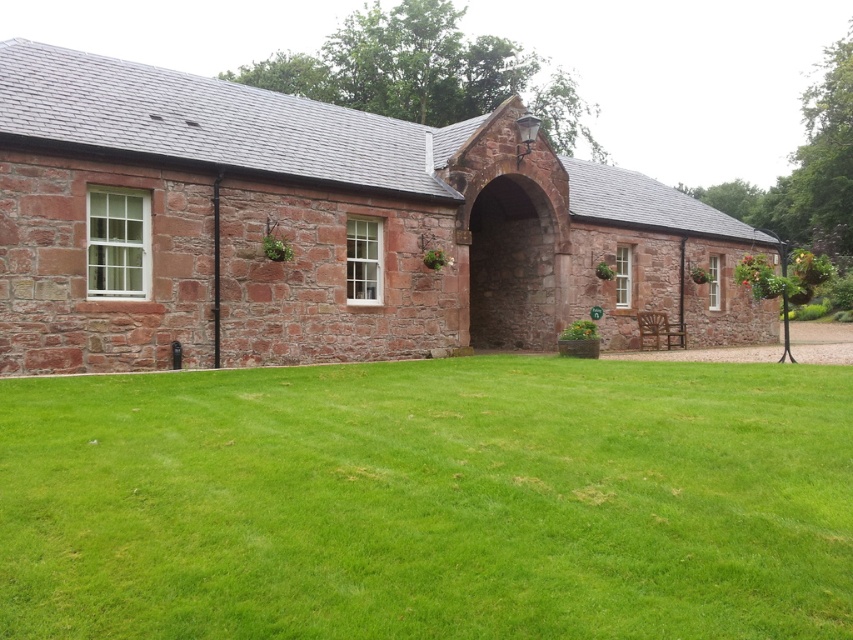
You are standing in front of the stone building and notice two points marked on its facade. The first point is at coordinate point(492, 536) and the second is at point(540, 276). From your vantage point, which point appears closer to you?

Point(492, 536) is in front of point(540, 276), so it appears closer to you.

You are standing in a field and see the green grass at center and the rustic stone chapel at center. Which object is closer to you?

The green grass at center is closer to you because it is in front of the rustic stone chapel at center.

You are an architect planning to install a decorative banner between the rustic stone chapel at center and the rustic stone archway at center. Since the banner must be as wide as the wider structure, which structure should you measure to ensure the banner fits properly?

The rustic stone chapel at center is wider than the rustic stone archway at center, so you should measure the rustic stone chapel at center to ensure the banner fits properly.